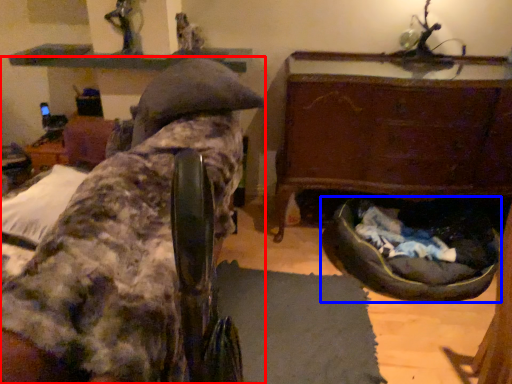
Question: Which of the following is the closest to the observer, furniture (highlighted by a red box) or dog bed (highlighted by a blue box)?

Choices:
 (A) furniture
 (B) dog bed

Answer: (A)